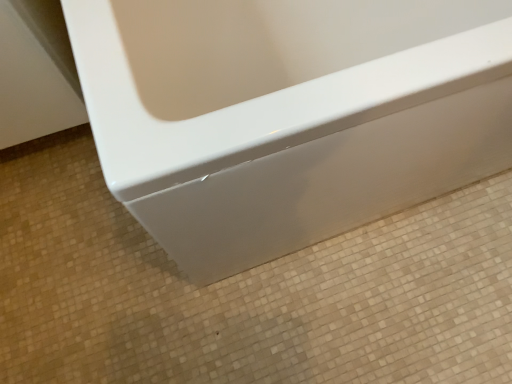
You are a GUI agent. You are given a task and a screenshot of the screen. Output one action in this format:
    pyautogui.click(x=<x>, y=<y>)
    Task: Click on the white glossy bathtub at center
    This screenshot has width=512, height=384.
    Given the screenshot: What is the action you would take?
    pyautogui.click(x=245, y=291)

What do you see at coordinates (245, 291) in the screenshot?
I see `white glossy bathtub at center` at bounding box center [245, 291].

What do you see at coordinates (288, 115) in the screenshot? This screenshot has height=384, width=512. I see `glossy white bathtub at center` at bounding box center [288, 115].

You are a GUI agent. You are given a task and a screenshot of the screen. Output one action in this format:
    pyautogui.click(x=<x>, y=<y>)
    Task: Click on the glossy white bathtub at center
    This screenshot has height=384, width=512.
    Given the screenshot: What is the action you would take?
    pyautogui.click(x=288, y=115)

Measure the distance between glossy white bathtub at center and camera.

18.02 inches.

I want to click on white glossy bathtub at center, so click(245, 291).

Considering the relative positions of white glossy bathtub at center and glossy white bathtub at center in the image provided, is white glossy bathtub at center to the right of glossy white bathtub at center from the viewer's perspective?

In fact, white glossy bathtub at center is to the left of glossy white bathtub at center.

Is the position of white glossy bathtub at center less distant than that of glossy white bathtub at center?

No, the depth of white glossy bathtub at center is greater than that of glossy white bathtub at center.

Is point (10, 172) positioned before point (415, 149)?

No, (10, 172) is behind (415, 149).

From the image's perspective, between white glossy bathtub at center and glossy white bathtub at center, who is located below?

white glossy bathtub at center.

From a real-world perspective, is white glossy bathtub at center physically located above or below glossy white bathtub at center?

In terms of real-world spatial position, white glossy bathtub at center is below glossy white bathtub at center.

Which object is thinner, white glossy bathtub at center or glossy white bathtub at center?

glossy white bathtub at center.

Looking at this image, considering the relative sizes of white glossy bathtub at center and glossy white bathtub at center in the image provided, is white glossy bathtub at center taller than glossy white bathtub at center?

Incorrect, the height of white glossy bathtub at center is not larger of that of glossy white bathtub at center.

Can you confirm if white glossy bathtub at center is bigger than glossy white bathtub at center?

No, white glossy bathtub at center is not bigger than glossy white bathtub at center.

Is glossy white bathtub at center located within white glossy bathtub at center?

No, glossy white bathtub at center is not surrounded by white glossy bathtub at center.

Is white glossy bathtub at center next to glossy white bathtub at center?

No, white glossy bathtub at center is not making contact with glossy white bathtub at center.

Is white glossy bathtub at center facing away from glossy white bathtub at center?

No, white glossy bathtub at center is not facing away from glossy white bathtub at center.

Locate an element on the screen. This screenshot has height=384, width=512. bathtub in front of the white glossy bathtub at center is located at coordinates (288, 115).

Considering the positions of objects glossy white bathtub at center and white glossy bathtub at center in the image provided, who is more to the left, glossy white bathtub at center or white glossy bathtub at center?

From the viewer's perspective, white glossy bathtub at center appears more on the left side.

Is the position of glossy white bathtub at center more distant than that of white glossy bathtub at center?

No.

Is point (279, 11) farther from camera compared to point (142, 378)?

Yes.

Based on the photo, from the image's perspective, is glossy white bathtub at center below white glossy bathtub at center?

Incorrect, from the image's perspective, glossy white bathtub at center is higher than white glossy bathtub at center.

From a real-world perspective, is glossy white bathtub at center over white glossy bathtub at center?

Yes.

Considering the relative sizes of glossy white bathtub at center and white glossy bathtub at center in the image provided, is glossy white bathtub at center wider than white glossy bathtub at center?

No.

Based on the photo, can you confirm if glossy white bathtub at center is shorter than white glossy bathtub at center?

No.

Considering the sizes of glossy white bathtub at center and white glossy bathtub at center in the image, is glossy white bathtub at center bigger or smaller than white glossy bathtub at center?

Considering their sizes, glossy white bathtub at center takes up more space than white glossy bathtub at center.

From the picture: Is white glossy bathtub at center inside glossy white bathtub at center?

No.

Are glossy white bathtub at center and white glossy bathtub at center making contact?

There is a gap between glossy white bathtub at center and white glossy bathtub at center.

Is glossy white bathtub at center turned away from white glossy bathtub at center?

No.

What's the angular difference between glossy white bathtub at center and white glossy bathtub at center's facing directions?

The angular difference between glossy white bathtub at center and white glossy bathtub at center is 88.4 degrees.

Find the location of a particular element. This screenshot has height=384, width=512. ceramic tile that appears behind the glossy white bathtub at center is located at coordinates (245, 291).

The image size is (512, 384). I want to click on ceramic tile below the glossy white bathtub at center (from the image's perspective), so click(245, 291).

The width and height of the screenshot is (512, 384). Identify the location of bathtub lying in front of the white glossy bathtub at center. (288, 115).